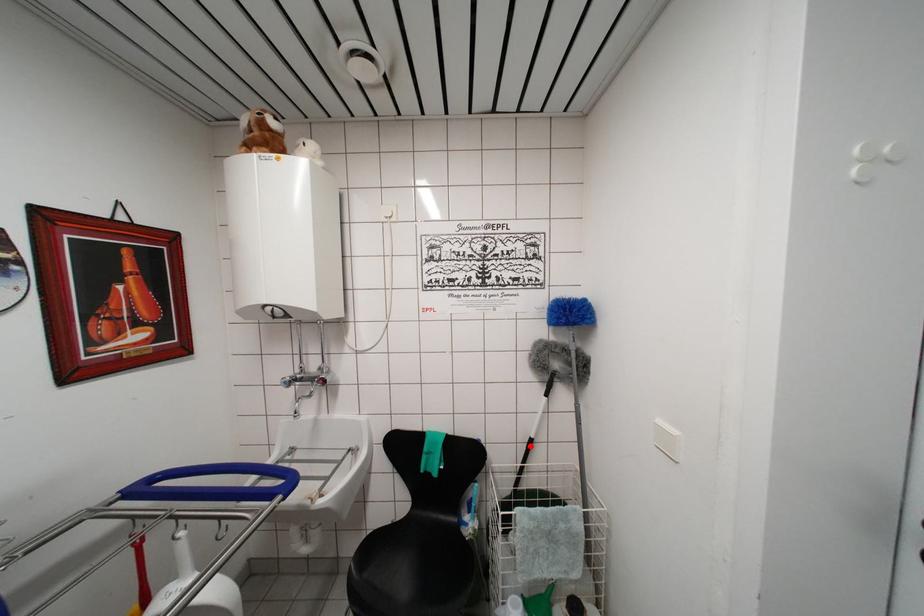
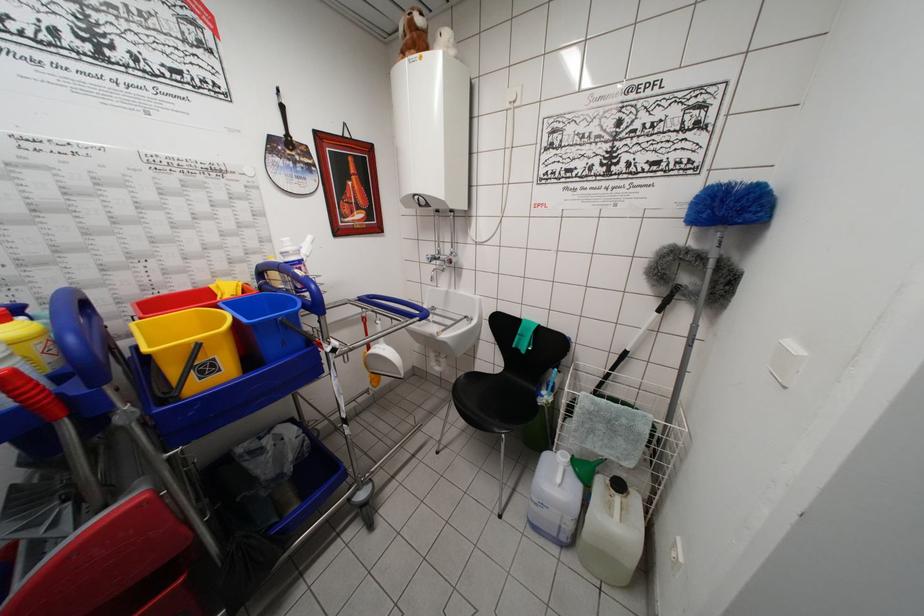
Question: I am providing you with two images of the same scene from different viewpoints. Image1 has a red point marked. In image2, the corresponding 3D location appears at what relative position? Reply with the corresponding letter.

Choices:
 (A) Closer
 (B) Farther

Answer: (A)